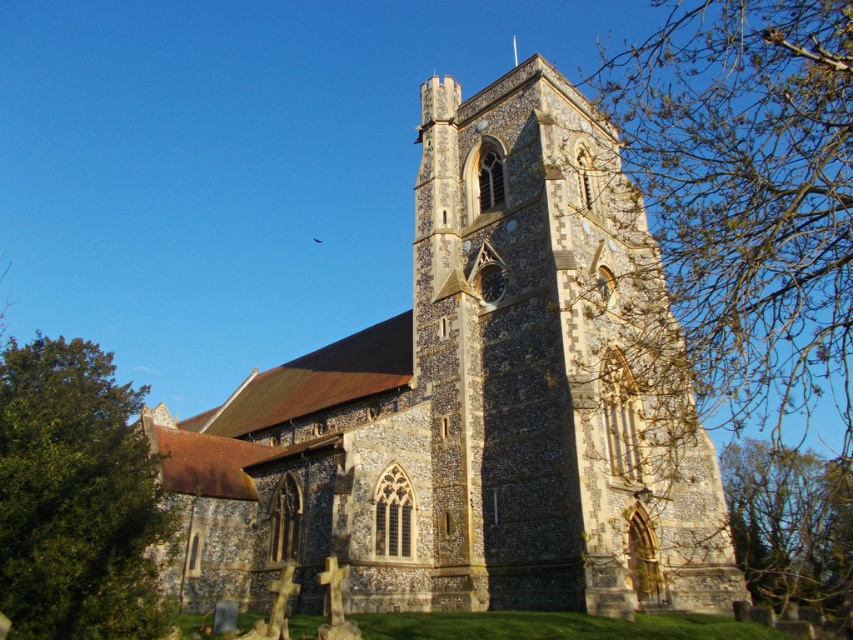
Does bare branches at upper right have a larger size compared to green leafy tree at lower right?

Indeed, bare branches at upper right has a larger size compared to green leafy tree at lower right.

Who is positioned more to the left, bare branches at upper right or green leafy tree at lower right?

Positioned to the left is green leafy tree at lower right.

Describe the element at coordinates (747, 195) in the screenshot. I see `bare branches at upper right` at that location.

Identify the location of bare branches at upper right. (747, 195).

Is brown stone church at center positioned in front of green leafy tree at lower left?

No, brown stone church at center is behind green leafy tree at lower left.

Between brown stone church at center and green leafy tree at lower left, which one is positioned lower?

Positioned lower is green leafy tree at lower left.

Which is behind, point (553, 148) or point (169, 536)?

Positioned behind is point (553, 148).

This screenshot has height=640, width=853. Find the location of `brown stone church at center`. brown stone church at center is located at coordinates (476, 403).

Is brown stone church at center to the left of bare branches at upper right from the viewer's perspective?

Correct, you'll find brown stone church at center to the left of bare branches at upper right.

Which is in front, point (515, 221) or point (737, 36)?

Point (737, 36) is in front.

Identify the location of brown stone church at center. [476, 403].